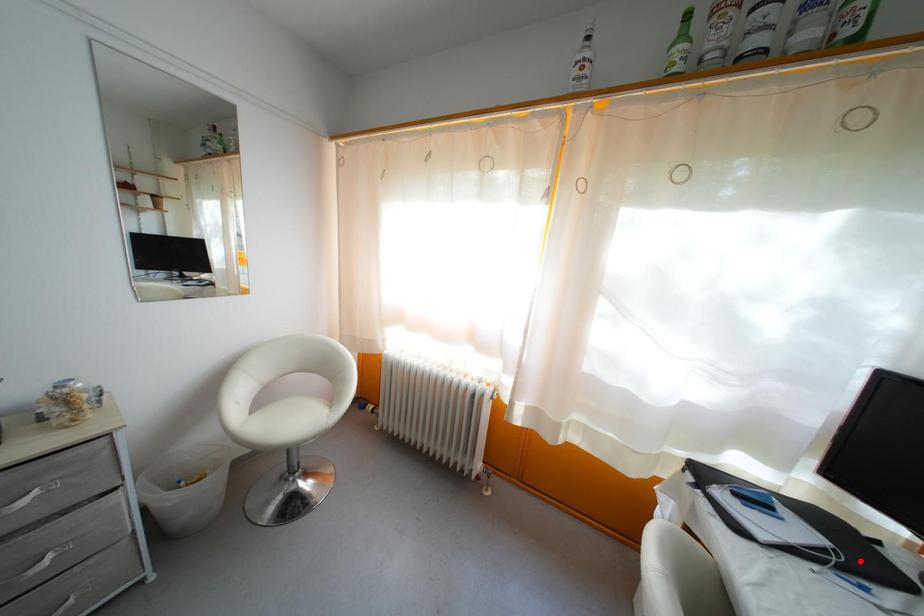
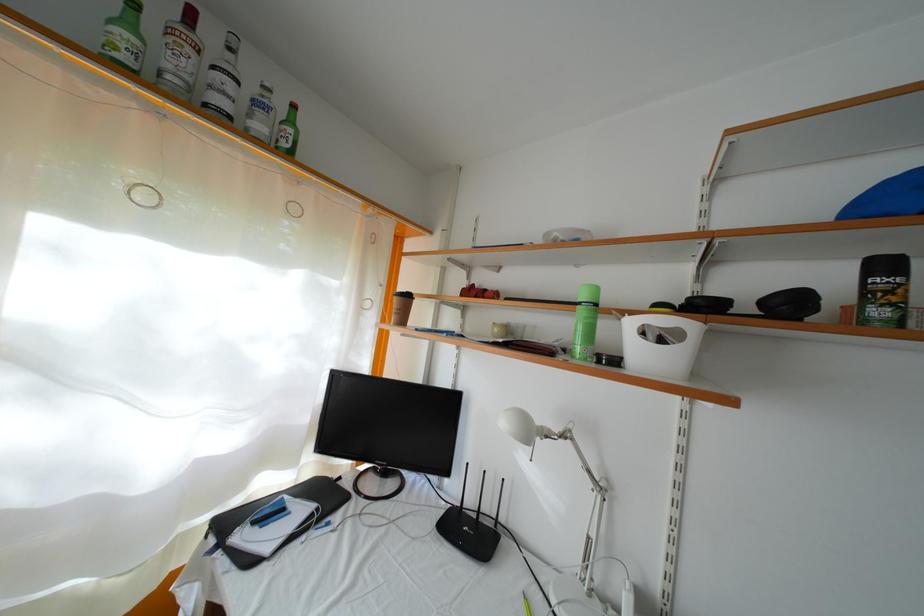
Locate, in the second image, the point that corresponds to the highlighted location in the first image.

(334, 506)